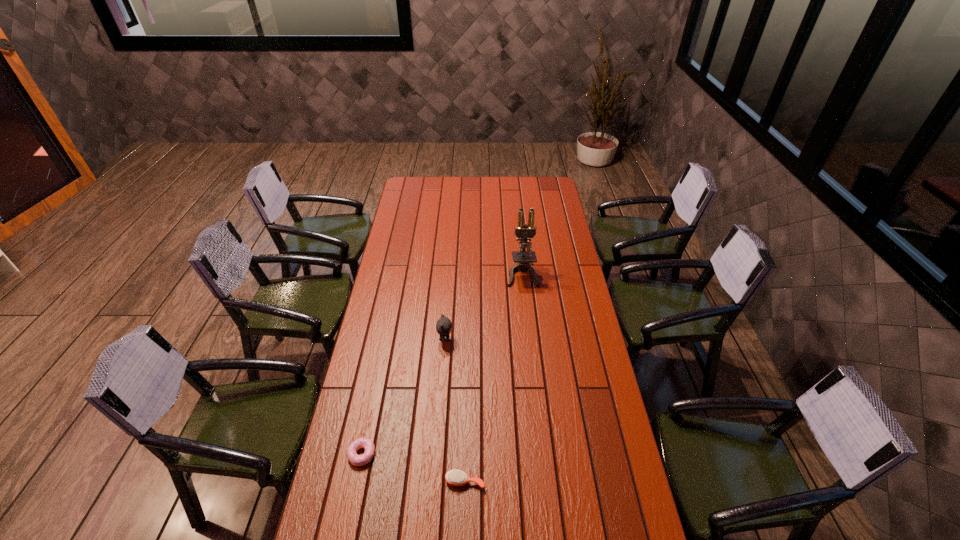
This screenshot has width=960, height=540. In order to click on vacant space situated 0.120m on the left of the second object from right to left in this screenshot , I will do `click(406, 482)`.

Where is `vacant area situated on the right of the doughnut`? The height and width of the screenshot is (540, 960). vacant area situated on the right of the doughnut is located at coordinates (419, 454).

Locate an element on the screen. object at the left edge is located at coordinates (358, 460).

Find the location of `vacant space at the far edge`. vacant space at the far edge is located at coordinates (493, 177).

This screenshot has width=960, height=540. I want to click on vacant area at the left edge of the desktop, so click(352, 473).

Identify the location of vacant space at the right edge of the desktop. (558, 327).

Locate an element on the screen. This screenshot has width=960, height=540. free space between the third farthest object and the kitten is located at coordinates (403, 396).

This screenshot has width=960, height=540. In order to click on vacant space in between the hairbrush and the third object from right to left in this screenshot , I will do coord(455,410).

This screenshot has width=960, height=540. Find the location of `free spot between the tallest object and the hairbrush`. free spot between the tallest object and the hairbrush is located at coordinates (493, 377).

Find the location of a particular element. free point between the second tallest object and the nearest object is located at coordinates (455, 410).